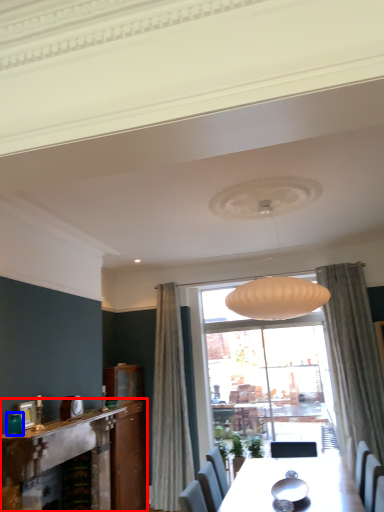
Question: Among these objects, which one is nearest to the camera, fireplace (highlighted by a red box) or teal (highlighted by a blue box)?

Choices:
 (A) fireplace
 (B) teal

Answer: (A)